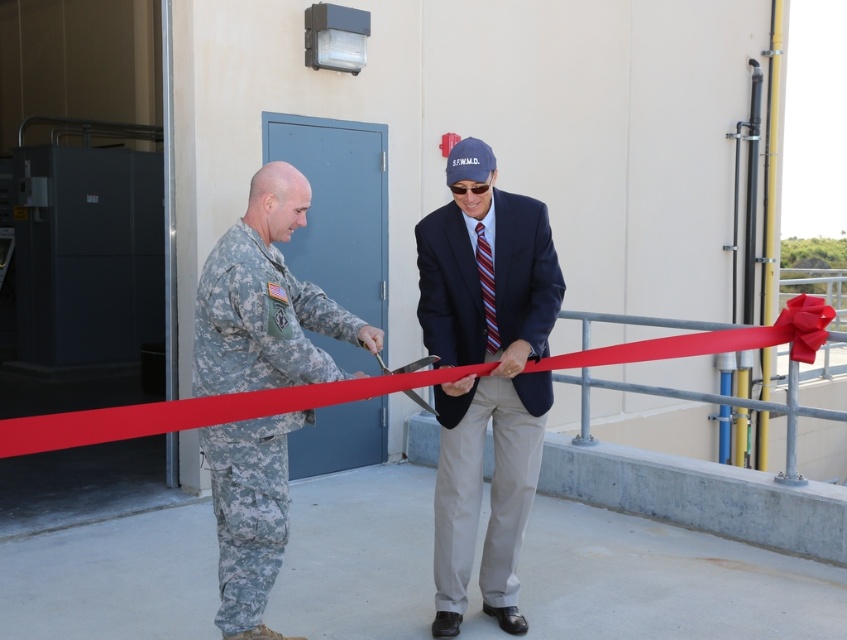
You are a photographer standing behind the two people at the ribbon cutting ceremony. You want to take a photo that includes both the dark blue suit at center and the red matte ribbon at center. Which object should you focus on first to ensure both are in frame?

The dark blue suit at center is much taller than the red matte ribbon at center, so you should focus on the dark blue suit at center first to ensure both are in frame.

You are standing in front of the ribbon cutting ceremony scene. There are two points marked as point 1 at coordinate point (534, 388) and point 2 at coordinate point (201, 401). Which point is closer to you?

Point 1 at coordinate point (534, 388) is closer to you because it is further to the viewer than point 2 at coordinate point (201, 401).

You are standing at the point marked by the coordinates point (x=485, y=376) in the image. Looking around, you see the dark blue suit at center and the red ribbon stretched horizontally across the scene. Which direction should you move to reach the dark blue suit at center?

The point marked by the coordinates point (x=485, y=376) is already at the location of the dark blue suit at center, so you are already there.